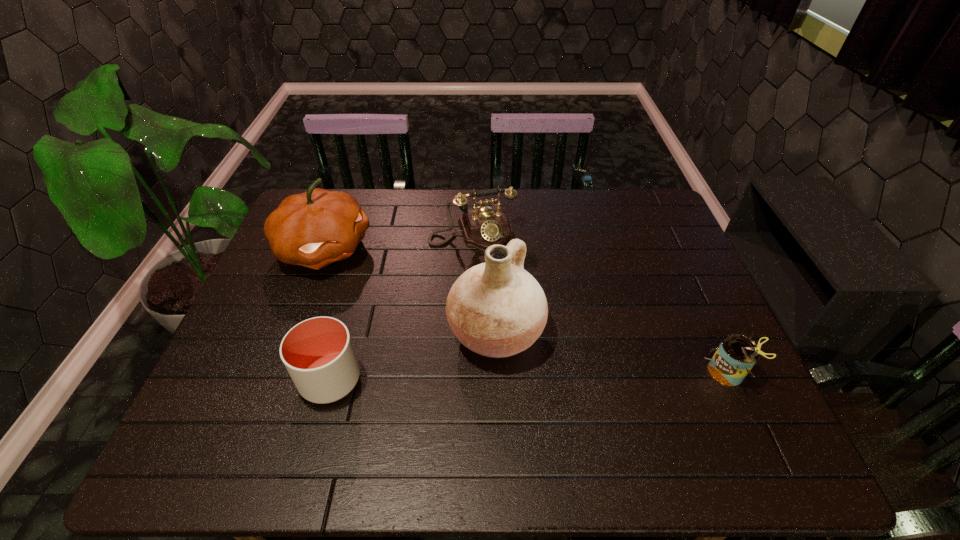
Locate an element on the screen. Image resolution: width=960 pixels, height=540 pixels. object present at the left edge is located at coordinates (313, 229).

Locate an element on the screen. The height and width of the screenshot is (540, 960). object at the right edge is located at coordinates (736, 355).

Identify the location of object that is at the far left corner. This screenshot has height=540, width=960. (313, 229).

Find the location of a particular element. The image size is (960, 540). object located in the near right corner section of the desktop is located at coordinates pyautogui.click(x=736, y=355).

This screenshot has width=960, height=540. In the image, there is a desktop. In order to click on vacant space at the far edge in this screenshot , I will do `click(618, 228)`.

At what (x,y) coordinates should I click in order to perform the action: click on vacant position at the near edge of the desktop. Please return your answer as a coordinate pair (x, y). Looking at the image, I should click on (515, 395).

Locate an element on the screen. free space at the left edge of the desktop is located at coordinates (283, 330).

The image size is (960, 540). In the image, there is a desktop. Identify the location of free space at the right edge. (686, 382).

In the image, there is a desktop. Where is `vacant space at the far right corner`? This screenshot has height=540, width=960. vacant space at the far right corner is located at coordinates (633, 221).

At what (x,y) coordinates should I click in order to perform the action: click on free area in between the can and the tallest object. Please return your answer as a coordinate pair (x, y). Looking at the image, I should click on [x=611, y=353].